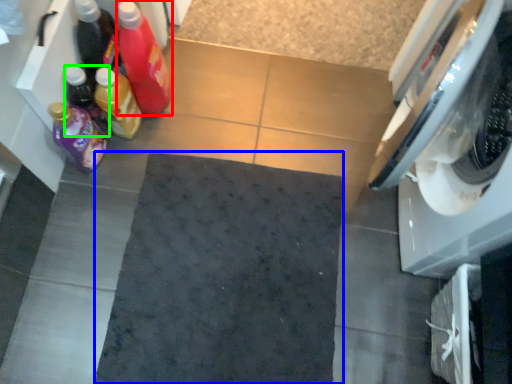
Question: Estimate the real-world distances between objects in this image. Which object is farther from bottle (highlighted by a red box), bath mat (highlighted by a blue box) or bottle (highlighted by a green box)?

Choices:
 (A) bath mat
 (B) bottle

Answer: (A)